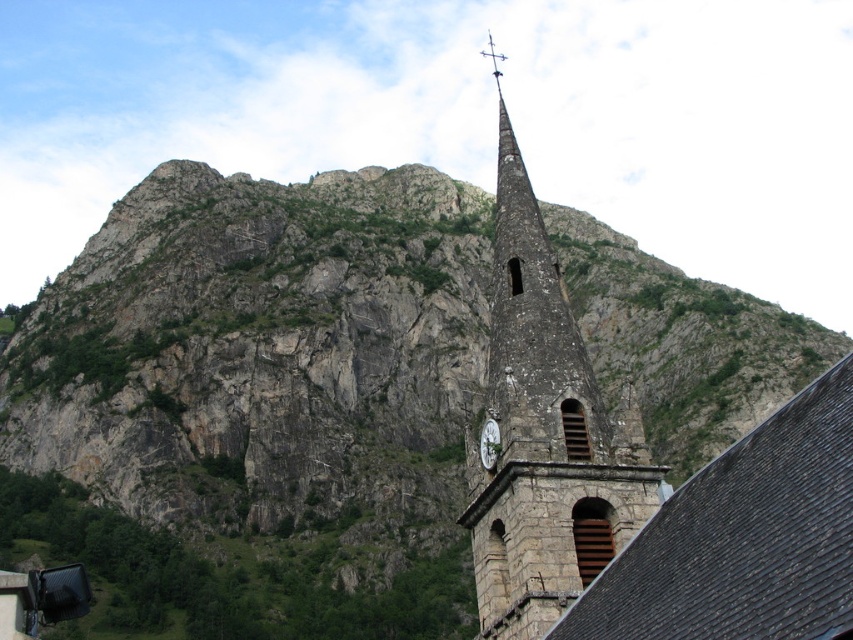
Question: Can you confirm if stone clock tower at center is smaller than white stone clock at center?

Choices:
 (A) no
 (B) yes

Answer: (A)

Question: Is the position of stone clock tower at center less distant than that of white stone clock at center?

Choices:
 (A) no
 (B) yes

Answer: (B)

Question: Does stone clock tower at center come in front of white stone clock at center?

Choices:
 (A) no
 (B) yes

Answer: (B)

Question: Which point is closer to the camera?

Choices:
 (A) (521, 582)
 (B) (496, 458)

Answer: (A)